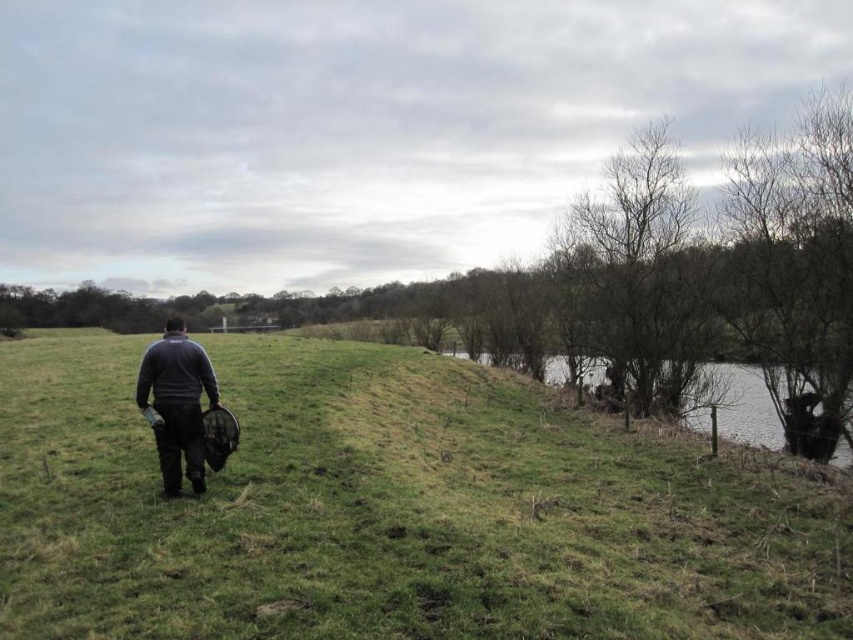
Is point (589, 200) positioned after point (751, 404)?

Yes.

Locate an element on the screen. bare branches at upper right is located at coordinates (637, 272).

Does dark gray fabric jacket at center have a lesser width compared to green grassy bank at right?

Indeed, dark gray fabric jacket at center has a lesser width compared to green grassy bank at right.

Find the location of `dark gray fabric jacket at center`. dark gray fabric jacket at center is located at coordinates (177, 403).

Who is more forward, (189, 355) or (550, 365)?

Point (189, 355)

Find the location of a particular element. Image resolution: width=853 pixels, height=640 pixels. dark gray fabric jacket at center is located at coordinates (177, 403).

The width and height of the screenshot is (853, 640). What do you see at coordinates (392, 509) in the screenshot?
I see `green grassy hill at center` at bounding box center [392, 509].

Looking at this image, between green grassy hill at center and dark gray fabric jacket at center, which one appears on the left side from the viewer's perspective?

From the viewer's perspective, dark gray fabric jacket at center appears more on the left side.

Find the location of a particular element. The image size is (853, 640). green grassy hill at center is located at coordinates (392, 509).